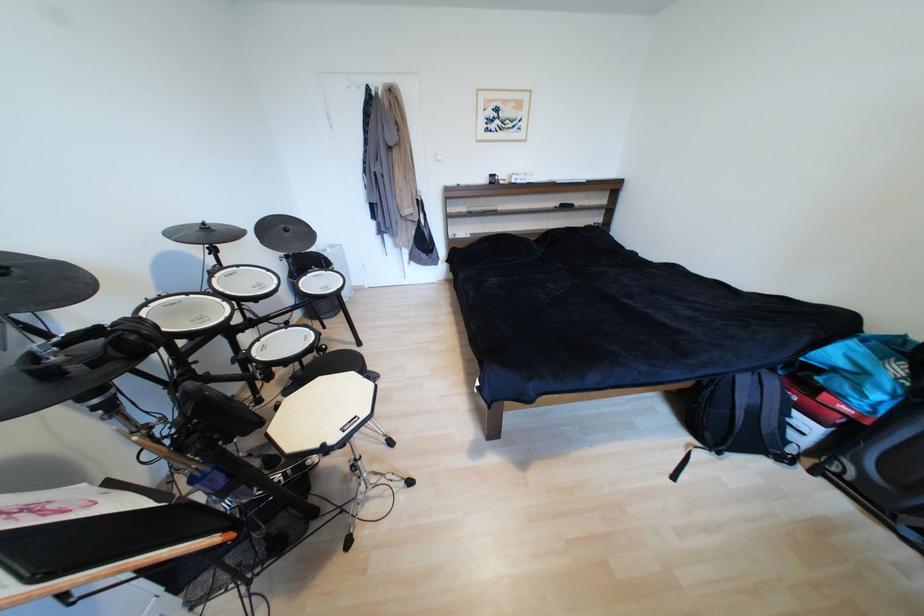
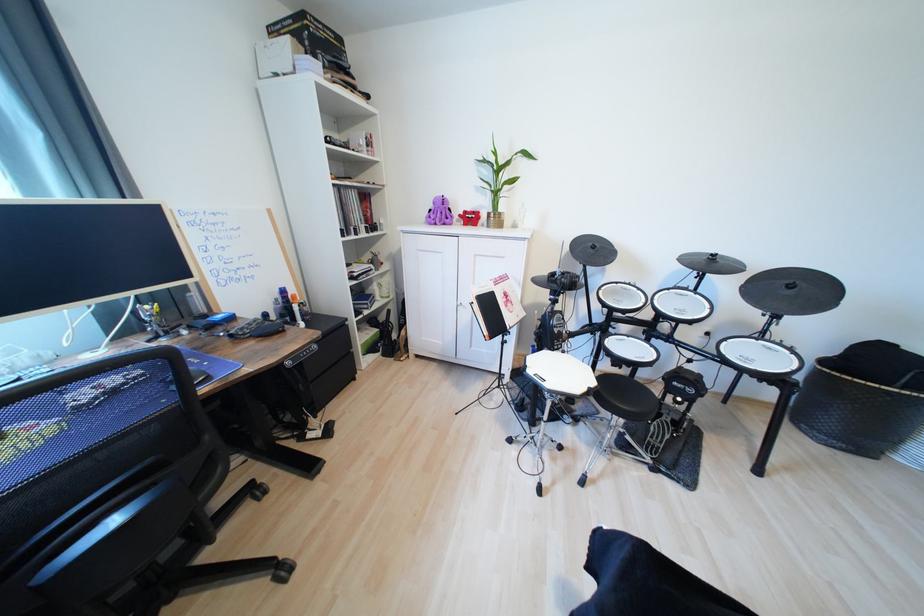
Find the pixel in the second image that matches (293,231) in the first image.

(797, 288)